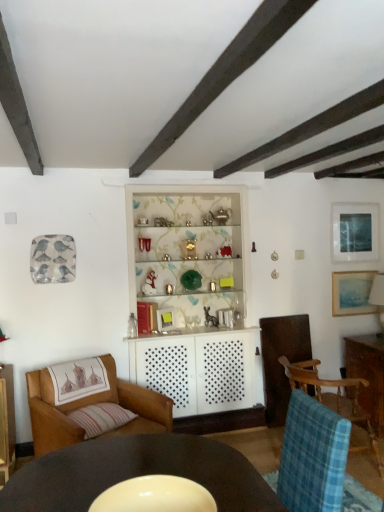
At what (x,y) coordinates should I click in order to perform the action: click on vacant point above smooth dark wood table at lower center (from a real-world perspective). Please return your answer as a coordinate pair (x, y). This screenshot has width=384, height=512. Looking at the image, I should click on (117, 459).